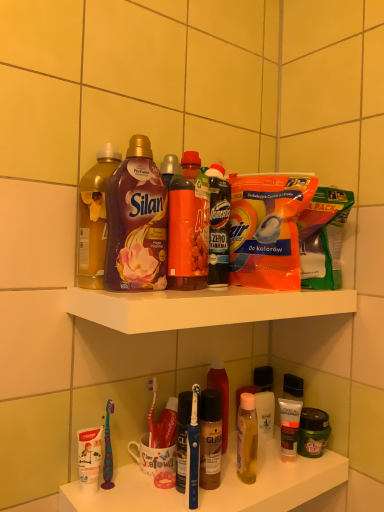
This screenshot has height=512, width=384. Identify the location of free point above white plastic toothbrushes at lower left (from a real-world perspective). (220, 470).